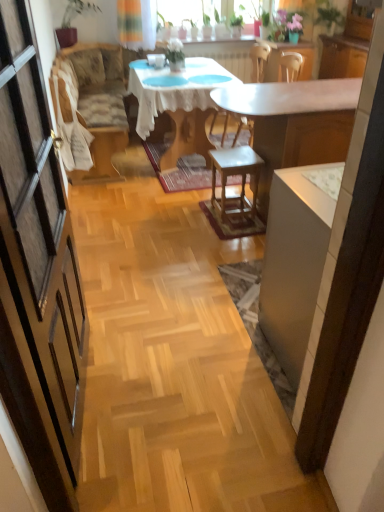
This screenshot has width=384, height=512. What are the coordinates of `free spot in front of wooden stool at center` in the screenshot? It's located at (231, 231).